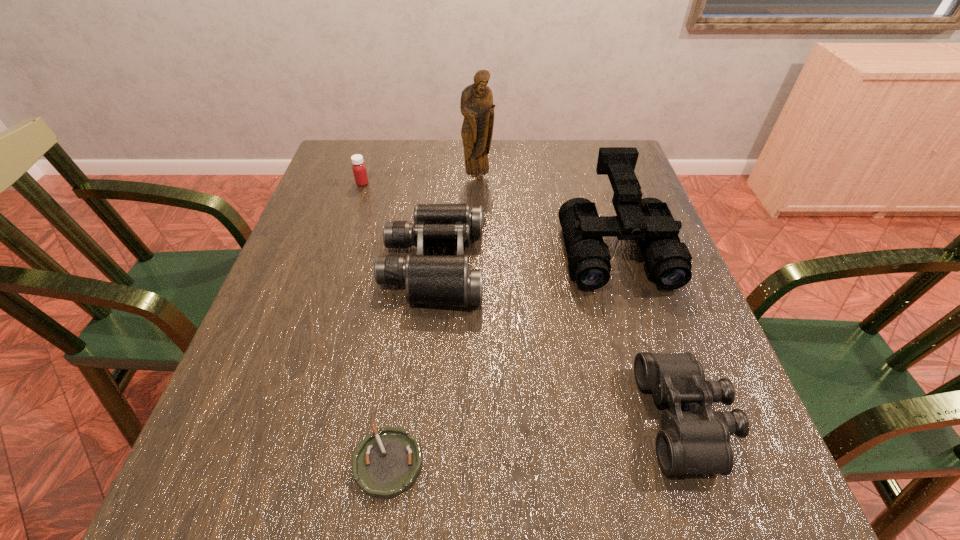
This screenshot has height=540, width=960. I want to click on vacant area that lies between the ashtray and the medicine, so click(x=375, y=323).

Find the location of a particular element. unoccupied area between the leftmost binoculars and the shortest object is located at coordinates (411, 363).

At what (x,y) coordinates should I click in order to perform the action: click on empty space between the second tallest object and the leftmost binoculars. Please return your answer as a coordinate pair (x, y). Looking at the image, I should click on (524, 256).

Locate an element on the screen. unoccupied position between the figurine and the tallest binoculars is located at coordinates (546, 213).

The height and width of the screenshot is (540, 960). I want to click on unoccupied area between the tallest binoculars and the leftmost object, so click(x=489, y=215).

The width and height of the screenshot is (960, 540). What are the coordinates of `free space between the fifth shortest object and the figurine` in the screenshot? It's located at (546, 213).

The image size is (960, 540). I want to click on vacant space that's between the shortest binoculars and the second tallest binoculars, so click(x=560, y=341).

Find the location of a particular element. the fourth closest object to the shortest binoculars is located at coordinates (477, 107).

Select which object appears as the fourth closest to the medicine. Please provide its 2D coordinates. Your answer should be formatted as a tuple, i.e. [(x, y)], where the tuple contains the x and y coordinates of a point satisfying the conditions above.

[(386, 463)]

Select which binoculars is the closest to the tallest object. Please provide its 2D coordinates. Your answer should be formatted as a tuple, i.e. [(x, y)], where the tuple contains the x and y coordinates of a point satisfying the conditions above.

[(445, 280)]